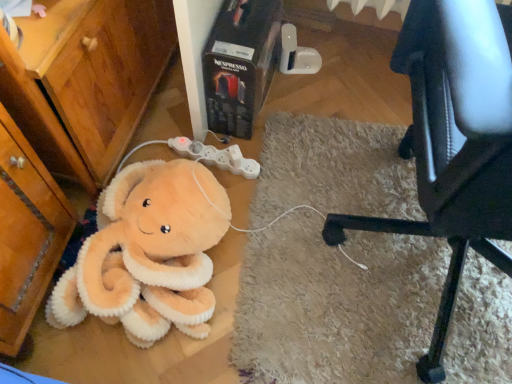
Where is `spots to the right of white plastic game controller at center`? This screenshot has height=384, width=512. spots to the right of white plastic game controller at center is located at coordinates (275, 168).